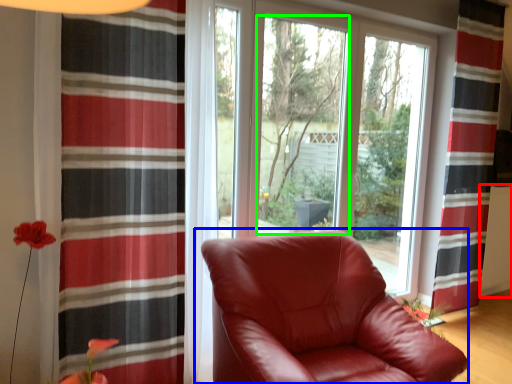
Question: Based on their relative distances, which object is nearer to radiator (highlighted by a red box)? Choose from chair (highlighted by a blue box) and window screen (highlighted by a green box).

Choices:
 (A) chair
 (B) window screen

Answer: (B)